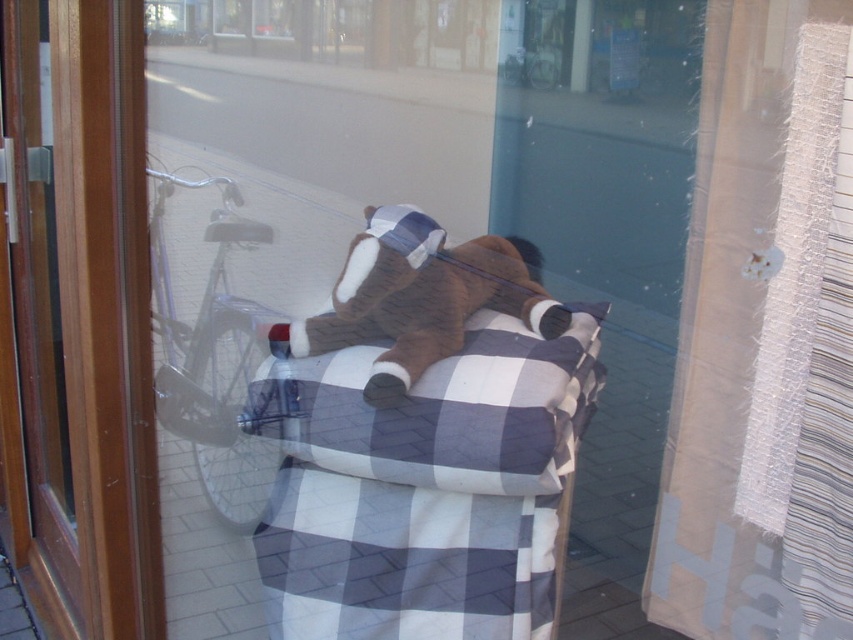
Can you confirm if textured beige curtain at right is positioned below brown plush toy at center?

Yes.

How distant is textured beige curtain at right from brown plush toy at center?

textured beige curtain at right is 21.32 inches from brown plush toy at center.

Describe the element at coordinates (744, 310) in the screenshot. I see `textured beige curtain at right` at that location.

Where is `textured beige curtain at right`? textured beige curtain at right is located at coordinates (744, 310).

Can you confirm if plush bear at center is positioned below brown wood screen door at center?

No, plush bear at center is not below brown wood screen door at center.

Does point (496, 134) come farther from viewer compared to point (10, 140)?

Yes.

Find the location of a particular element. Image resolution: width=853 pixels, height=640 pixels. plush bear at center is located at coordinates (474, 182).

At what (x,y) coordinates should I click in order to perform the action: click on plush bear at center. Please return your answer as a coordinate pair (x, y). Looking at the image, I should click on (474, 182).

Is checkered fabric blanket at center thinner than blue plaid fabric at center?

No.

Locate an element on the screen. The image size is (853, 640). checkered fabric blanket at center is located at coordinates (422, 486).